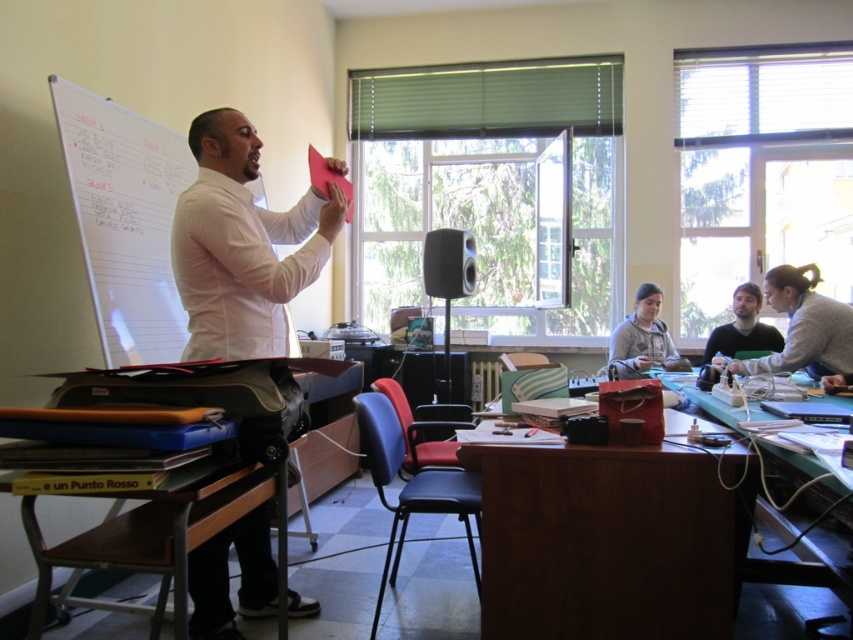
Is wooden desk at lower right shorter than dark gray sweater at lower right?

Yes.

This screenshot has width=853, height=640. Identify the location of wooden desk at lower right. (712, 401).

Is white matte shirt at center positioned in front of gray sweater at lower right?

Yes.

Does white matte shirt at center have a lesser width compared to gray sweater at lower right?

Correct, white matte shirt at center's width is less than gray sweater at lower right's.

Find the location of `white matte shirt at center`. white matte shirt at center is located at coordinates (242, 244).

At what (x,y) coordinates should I click in order to perform the action: click on white matte shirt at center. Please return your answer as a coordinate pair (x, y). The width and height of the screenshot is (853, 640). Looking at the image, I should click on (242, 244).

Which is above, white matte shirt at center or gray fleece sweater at lower center?

white matte shirt at center

Who is more forward, (296, 605) or (630, 355)?

Point (296, 605) is in front.

Where is `white matte shirt at center`? white matte shirt at center is located at coordinates (242, 244).